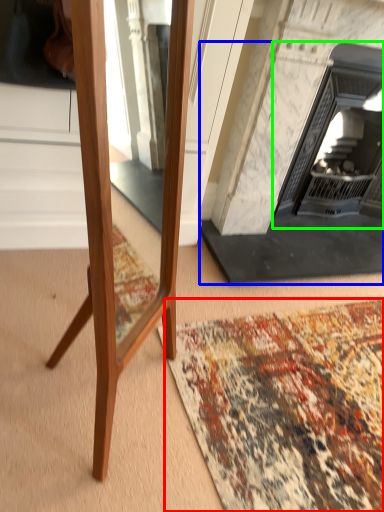
Question: Estimate the real-world distances between objects in this image. Which object is closer to mat (highlighted by a red box), fireplace (highlighted by a blue box) or fireplace (highlighted by a green box)?

Choices:
 (A) fireplace
 (B) fireplace

Answer: (A)